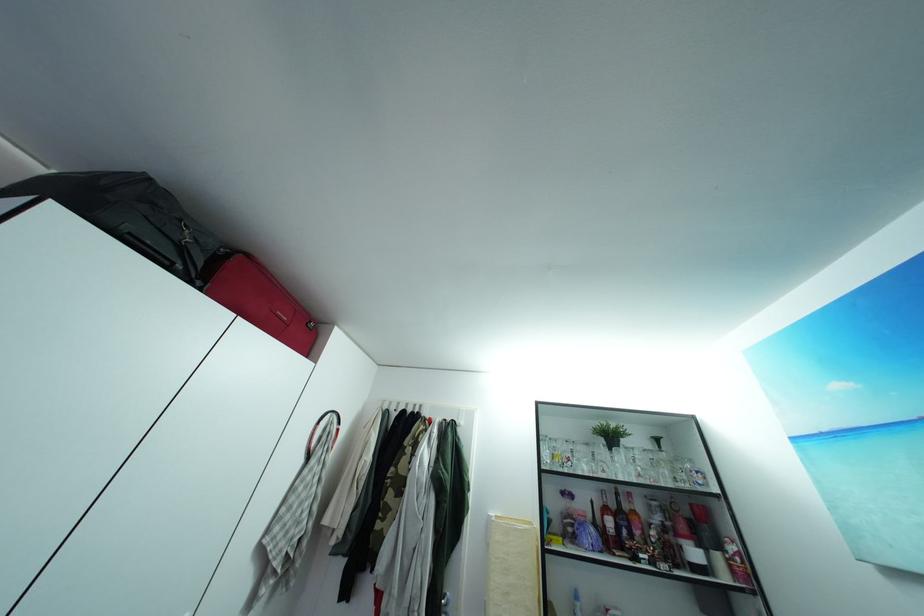
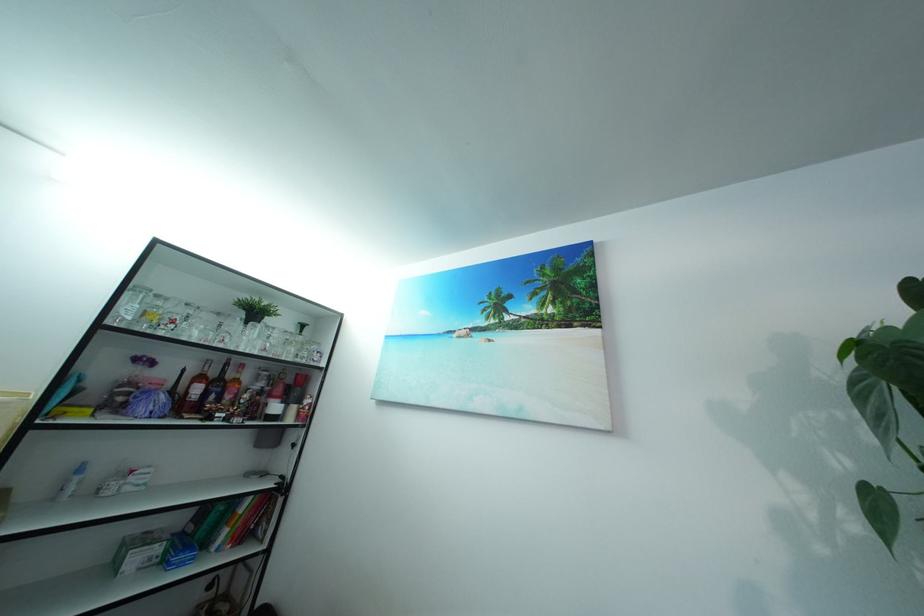
The point at (645, 459) is marked in the first image. Where is the corresponding point in the second image?

(284, 339)